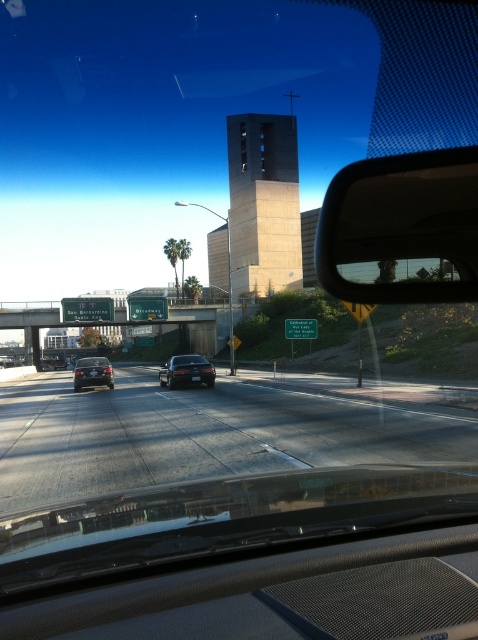
Who is more forward, (x=193, y=316) or (x=195, y=356)?

Point (x=195, y=356)

Is green sign at upper center to the right of satin black sedan at center from the viewer's perspective?

In fact, green sign at upper center is to the left of satin black sedan at center.

Does point (25, 301) come in front of point (173, 356)?

No, it is behind (173, 356).

Where is `green sign at upper center`? This screenshot has height=640, width=478. green sign at upper center is located at coordinates (85, 323).

Which of these two, smooth asphalt highway at center or green sign at upper center, stands shorter?

smooth asphalt highway at center is shorter.

Can you confirm if smooth asphalt highway at center is smaller than green sign at upper center?

Yes, smooth asphalt highway at center is smaller than green sign at upper center.

Locate an element on the screen. The image size is (478, 640). smooth asphalt highway at center is located at coordinates (202, 435).

Where is `smooth asphalt highway at center`? smooth asphalt highway at center is located at coordinates (202, 435).

Is smooth asphalt highway at center in front of satin black sedan at center?

Yes, it is in front of satin black sedan at center.

Is point (332, 397) behind point (183, 381)?

No, (332, 397) is in front of (183, 381).

Who is more forward, [225,388] or [192,384]?

Point [225,388] is more forward.

Find the location of a particular element. This screenshot has height=640, width=478. smooth asphalt highway at center is located at coordinates (202, 435).